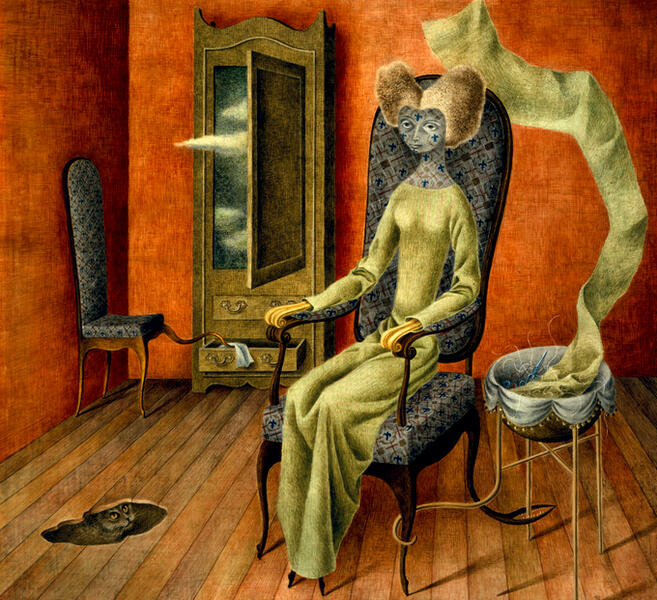
Image resolution: width=657 pixels, height=600 pixels. What are the coordinates of `chair` in the screenshot? It's located at (87, 288).